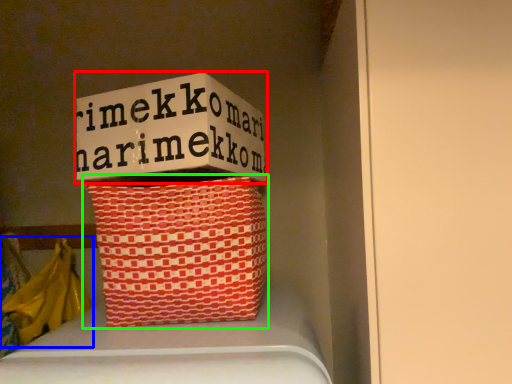
Question: Which object is positioned farthest from box (highlighted by a red box)? Select from material (highlighted by a blue box) and basket (highlighted by a green box).

Choices:
 (A) material
 (B) basket

Answer: (A)